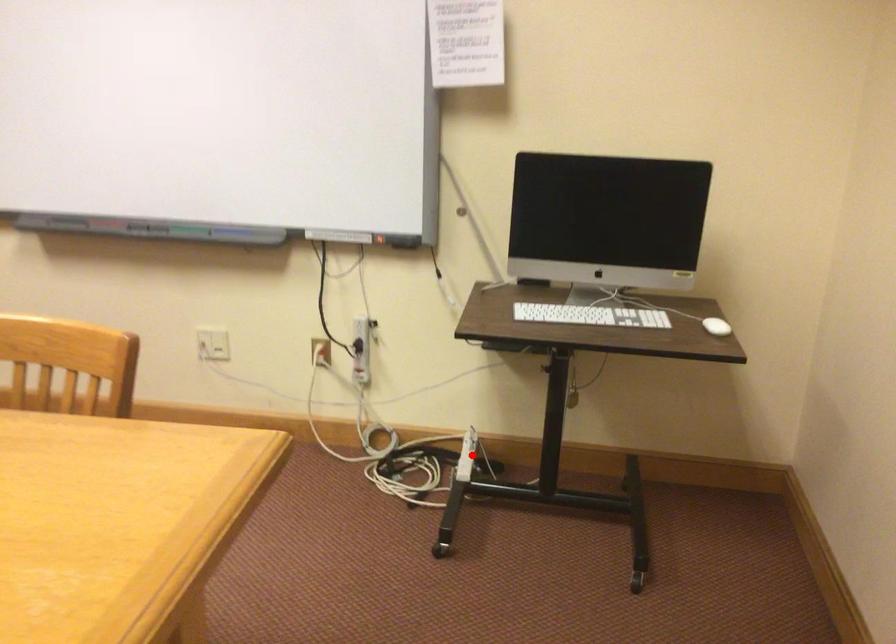
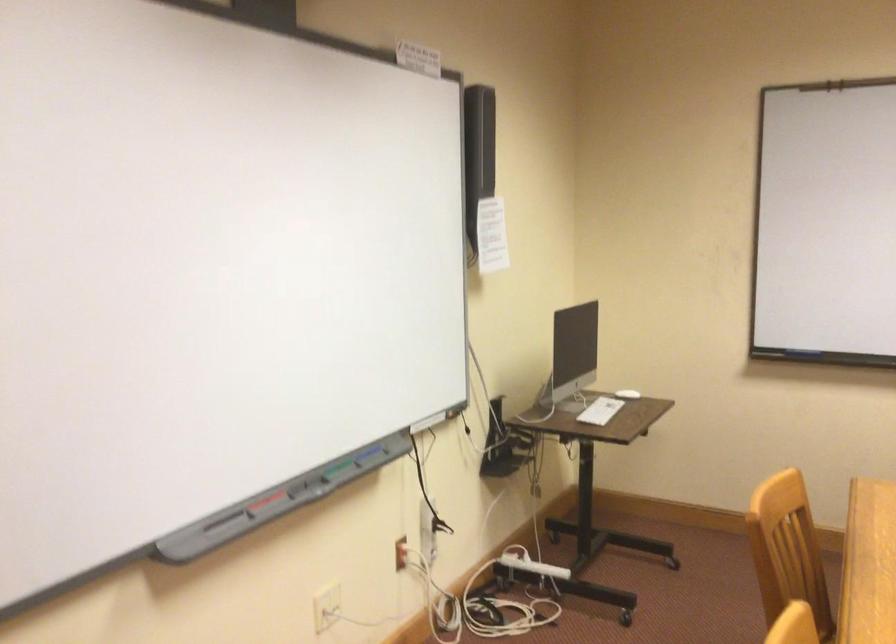
The point at the highlighted location is marked in the first image. Where is the corresponding point in the second image?

(530, 564)